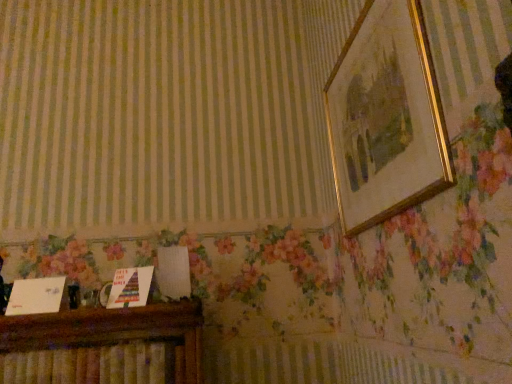
Question: Is wooden cabinet at lower left turned away from gold/golden picture frame at upper right?

Choices:
 (A) no
 (B) yes

Answer: (A)

Question: Considering the relative sizes of wooden cabinet at lower left and gold/golden picture frame at upper right in the image provided, is wooden cabinet at lower left bigger than gold/golden picture frame at upper right?

Choices:
 (A) yes
 (B) no

Answer: (B)

Question: Is wooden cabinet at lower left shorter than gold/golden picture frame at upper right?

Choices:
 (A) yes
 (B) no

Answer: (A)

Question: Can you confirm if wooden cabinet at lower left is thinner than gold/golden picture frame at upper right?

Choices:
 (A) yes
 (B) no

Answer: (B)

Question: Is wooden cabinet at lower left smaller than gold/golden picture frame at upper right?

Choices:
 (A) no
 (B) yes

Answer: (B)

Question: From a real-world perspective, is wooden cabinet at lower left on gold/golden picture frame at upper right?

Choices:
 (A) no
 (B) yes

Answer: (A)

Question: Is wooden cabinet at lower left surrounded by gold/golden picture frame at upper right?

Choices:
 (A) no
 (B) yes

Answer: (A)

Question: Can you confirm if gold/golden picture frame at upper right is positioned to the left of wooden cabinet at lower left?

Choices:
 (A) yes
 (B) no

Answer: (B)

Question: Does gold/golden picture frame at upper right appear on the right side of wooden cabinet at lower left?

Choices:
 (A) no
 (B) yes

Answer: (B)

Question: Is gold/golden picture frame at upper right positioned with its back to wooden cabinet at lower left?

Choices:
 (A) yes
 (B) no

Answer: (B)

Question: Can you confirm if gold/golden picture frame at upper right is thinner than wooden cabinet at lower left?

Choices:
 (A) no
 (B) yes

Answer: (B)

Question: Is gold/golden picture frame at upper right facing towards wooden cabinet at lower left?

Choices:
 (A) yes
 (B) no

Answer: (B)

Question: Is wooden cabinet at lower left in front of or behind gold/golden picture frame at upper right in the image?

Choices:
 (A) front
 (B) behind

Answer: (B)